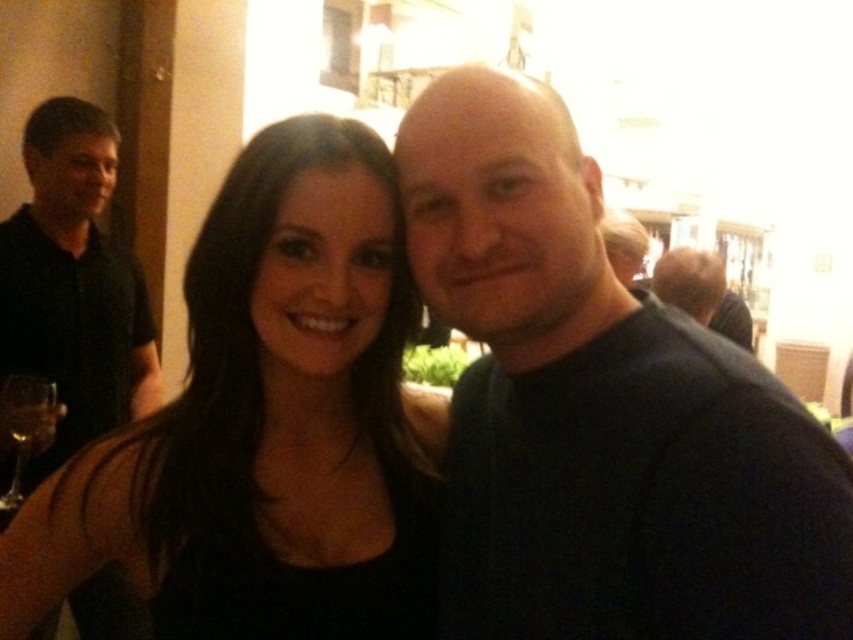
Does black matte dress at center lie behind transparent glass wine glass at lower left?

No, it is in front of transparent glass wine glass at lower left.

Based on the photo, is black matte dress at center wider than transparent glass wine glass at lower left?

Indeed, black matte dress at center has a greater width compared to transparent glass wine glass at lower left.

Which is behind, point (177, 403) or point (13, 374)?

Positioned behind is point (13, 374).

The width and height of the screenshot is (853, 640). I want to click on black matte dress at center, so click(x=265, y=424).

Is dark blue shirt at center shorter than transparent glass wine glass at lower left?

In fact, dark blue shirt at center may be taller than transparent glass wine glass at lower left.

From the picture: Which of these two, dark blue shirt at center or transparent glass wine glass at lower left, stands shorter?

transparent glass wine glass at lower left is shorter.

Is point (403, 120) closer to viewer compared to point (33, 396)?

Yes, it is in front of point (33, 396).

In order to click on dark blue shirt at center in this screenshot , I will do `click(601, 410)`.

Does black matte dress at center have a lesser height compared to black shirt at left?

Correct, black matte dress at center is not as tall as black shirt at left.

Describe the element at coordinates (265, 424) in the screenshot. This screenshot has width=853, height=640. I see `black matte dress at center` at that location.

Find the location of a particular element. The image size is (853, 640). black matte dress at center is located at coordinates (265, 424).